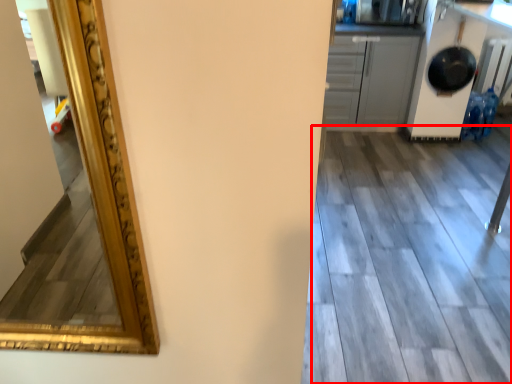
Question: From the image's perspective, where is tile (annotated by the red box) located in relation to cabinetry in the image?

Choices:
 (A) below
 (B) above

Answer: (A)